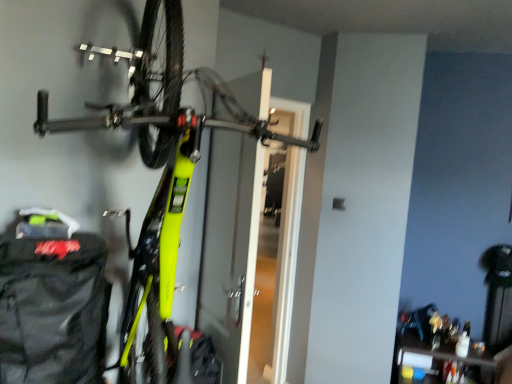
Question: Relative to black fabric backpack at lower left, is neon yellow matte bicycle at center in front or behind?

Choices:
 (A) behind
 (B) front

Answer: (B)

Question: Considering the positions of neon yellow matte bicycle at center and black fabric backpack at lower left in the image, is neon yellow matte bicycle at center bigger or smaller than black fabric backpack at lower left?

Choices:
 (A) big
 (B) small

Answer: (A)

Question: Would you say neon yellow matte bicycle at center is inside or outside black fabric backpack at lower left?

Choices:
 (A) inside
 (B) outside

Answer: (B)

Question: Considering their positions, is black fabric backpack at lower left located in front of or behind neon yellow matte bicycle at center?

Choices:
 (A) front
 (B) behind

Answer: (B)

Question: Would you say black fabric backpack at lower left is inside or outside neon yellow matte bicycle at center?

Choices:
 (A) inside
 (B) outside

Answer: (A)

Question: Considering the positions of black fabric backpack at lower left and neon yellow matte bicycle at center in the image, is black fabric backpack at lower left taller or shorter than neon yellow matte bicycle at center?

Choices:
 (A) short
 (B) tall

Answer: (A)

Question: Does point pos(89,283) appear closer or farther from the camera than point pos(159,119)?

Choices:
 (A) farther
 (B) closer

Answer: (A)